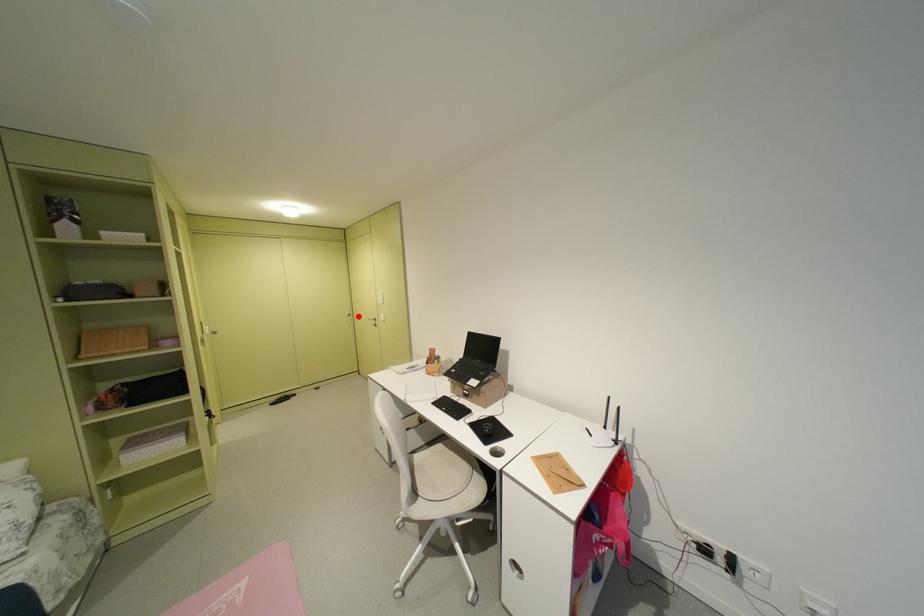
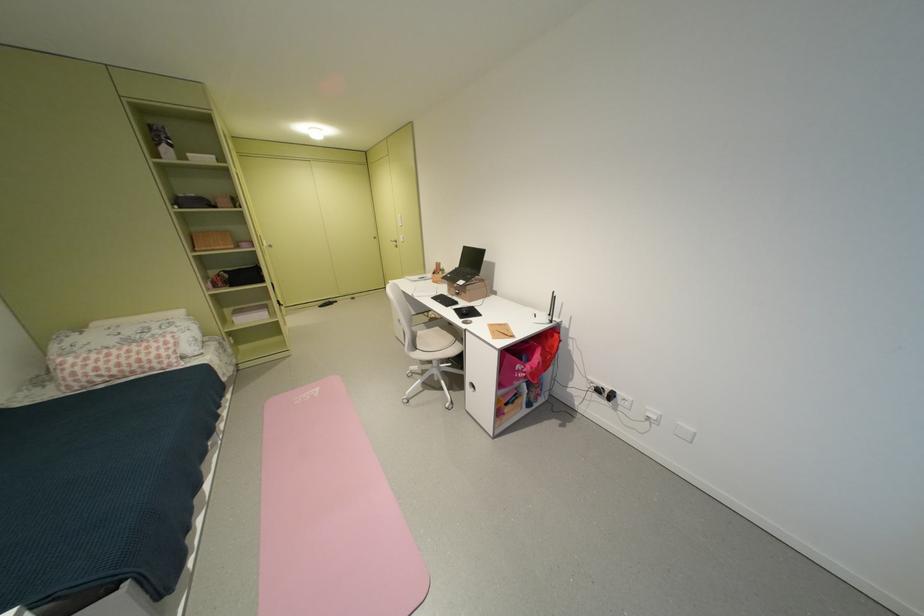
The point at the highlighted location is marked in the first image. Where is the corresponding point in the second image?

(383, 238)